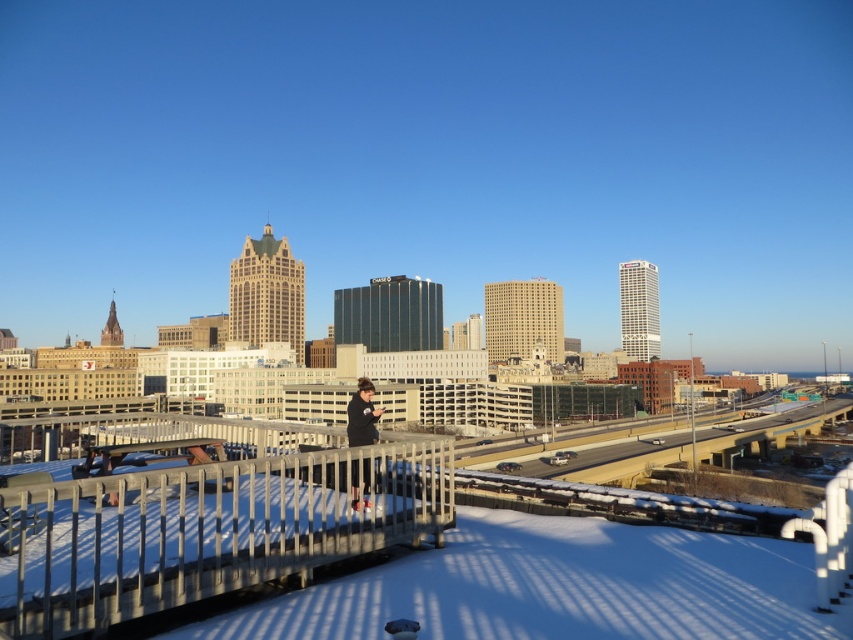
Does metallic gray railing at lower center lie behind black fabric at center?

No, metallic gray railing at lower center is in front of black fabric at center.

This screenshot has height=640, width=853. I want to click on metallic gray railing at lower center, so click(204, 531).

At what (x,y) coordinates should I click in order to perform the action: click on metallic gray railing at lower center. Please return your answer as a coordinate pair (x, y). Looking at the image, I should click on (204, 531).